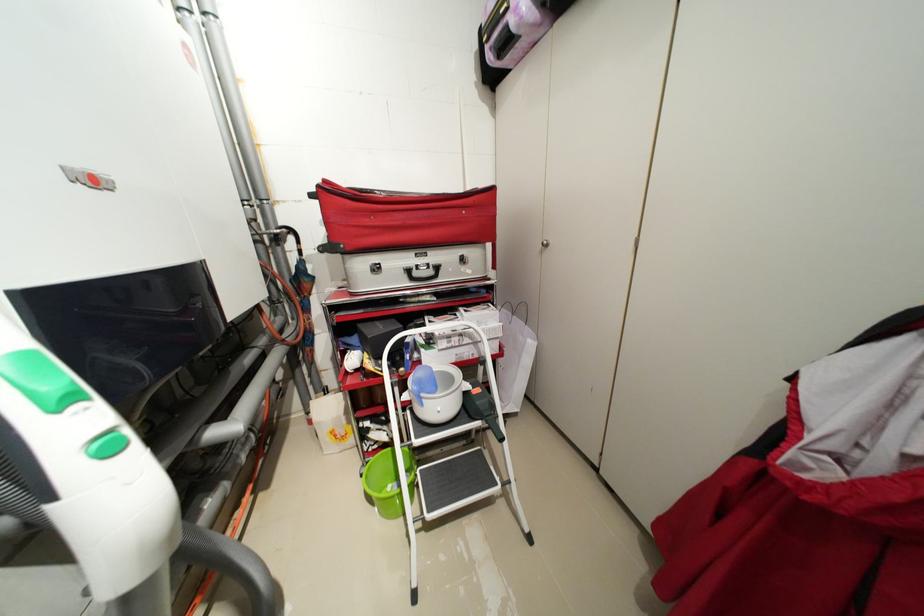
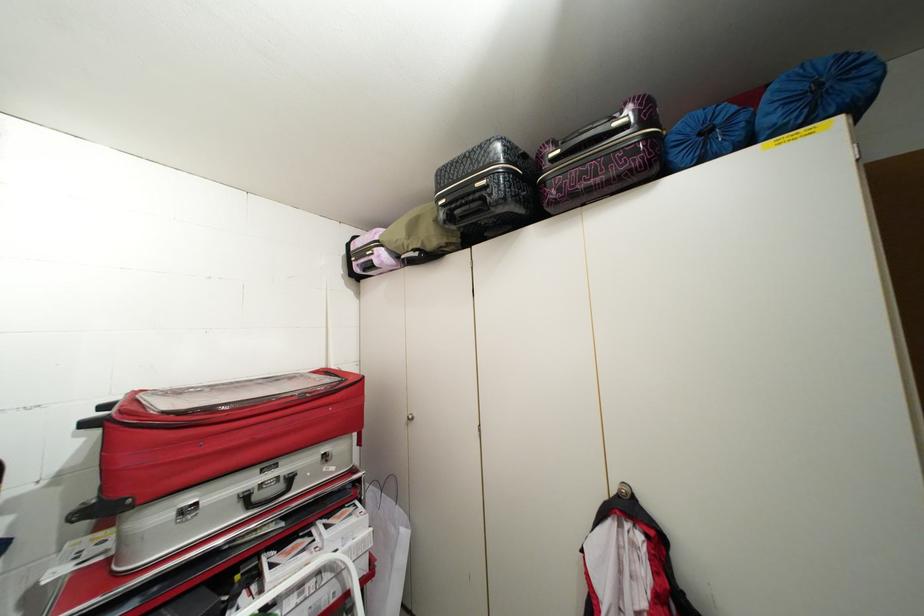
Consider the image. How did the camera likely rotate?

The camera's rotation is toward right-up.